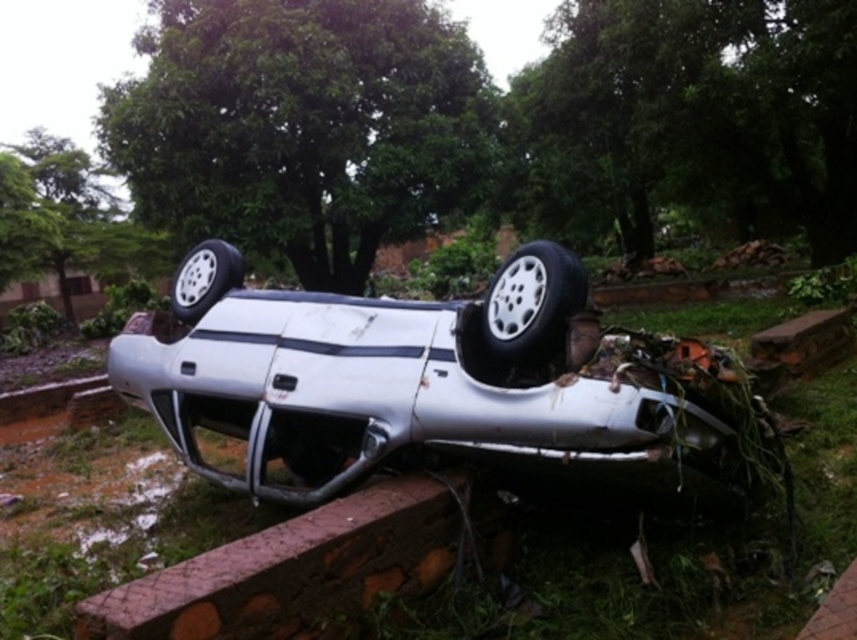
Does white matte car at center have a larger size compared to white rubber tire at center?

Correct, white matte car at center is larger in size than white rubber tire at center.

Can you confirm if white matte car at center is positioned below white rubber tire at center?

Correct, white matte car at center is located below white rubber tire at center.

Between point (336, 321) and point (232, 276), which one is positioned behind?

Positioned behind is point (232, 276).

The height and width of the screenshot is (640, 857). Find the location of `white matte car at center`. white matte car at center is located at coordinates (442, 388).

Is white matte car at center to the right of silver metallic tire at center from the viewer's perspective?

Incorrect, white matte car at center is not on the right side of silver metallic tire at center.

Is point (526, 426) behind point (488, 324)?

No.

Describe the element at coordinates (442, 388) in the screenshot. I see `white matte car at center` at that location.

The image size is (857, 640). What are the coordinates of `white matte car at center` in the screenshot? It's located at (442, 388).

Which is below, brown textured curb at lower center or white rubber tire at center?

Positioned lower is brown textured curb at lower center.

Can you confirm if brown textured curb at lower center is wider than white rubber tire at center?

Yes.

Where is `brown textured curb at lower center`? The height and width of the screenshot is (640, 857). brown textured curb at lower center is located at coordinates pos(291,570).